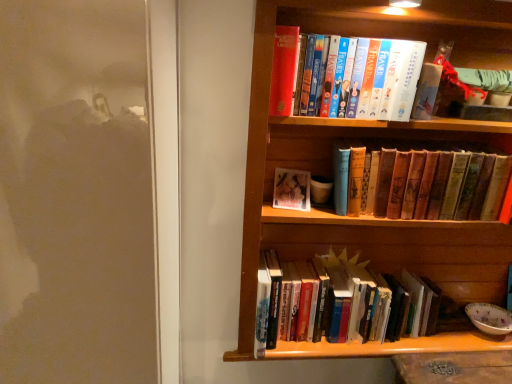
Question: In the image, is hardcover books at center, which is counted as the third book, starting from the top, on the left side or the right side of wooden bookcase at upper right?

Choices:
 (A) right
 (B) left

Answer: (B)

Question: From a real-world perspective, is hardcover books at center, which is counted as the third book, starting from the top, physically located above or below wooden bookcase at upper right?

Choices:
 (A) below
 (B) above

Answer: (A)

Question: Based on their relative distances, which object is nearer to the hardcover book at upper center, the 1th book in the top-to-bottom sequence?

Choices:
 (A) vintage leather book at center, positioned as the 2th book in bottom-to-top order
 (B) hardcover books at center, which is counted as the third book, starting from the top
 (C) wooden bookcase at upper right

Answer: (A)

Question: Estimate the real-world distances between objects in this image. Which object is closer to the wooden bookcase at upper right?

Choices:
 (A) hardcover book at upper center, the 1th book in the top-to-bottom sequence
 (B) vintage leather book at center, acting as the 2th book starting from the top
 (C) hardcover books at center, acting as the first book starting from the bottom

Answer: (B)